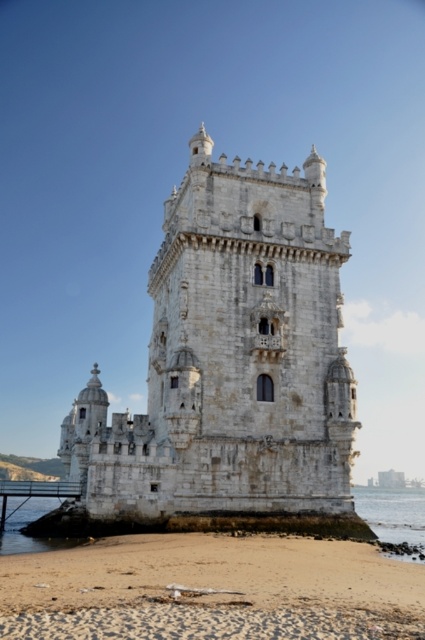
Question: Observing the image, what is the correct spatial positioning of white stone tower at center in reference to clear water at lower right?

Choices:
 (A) right
 (B) left

Answer: (B)

Question: Can you confirm if white stone tower at center is bigger than sandy beach at lower center?

Choices:
 (A) yes
 (B) no

Answer: (A)

Question: Estimate the real-world distances between objects in this image. Which object is farther from the sandy beach at lower center?

Choices:
 (A) white stone tower at center
 (B) clear water at lower right

Answer: (B)

Question: Can you confirm if white stone tower at center is positioned above sandy beach at lower center?

Choices:
 (A) no
 (B) yes

Answer: (B)

Question: Among these objects, which one is nearest to the camera?

Choices:
 (A) white stone tower at center
 (B) clear water at lower right

Answer: (A)

Question: Which object is the farthest from the white stone tower at center?

Choices:
 (A) clear water at lower right
 (B) sandy beach at lower center

Answer: (A)